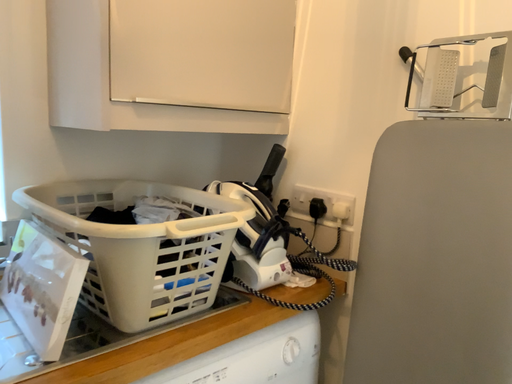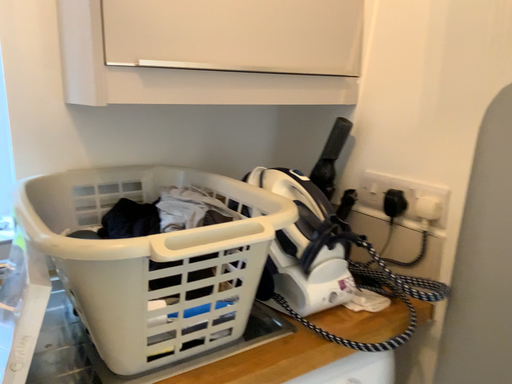
Question: How did the camera likely rotate when shooting the video?

Choices:
 (A) rotated left
 (B) rotated right

Answer: (A)